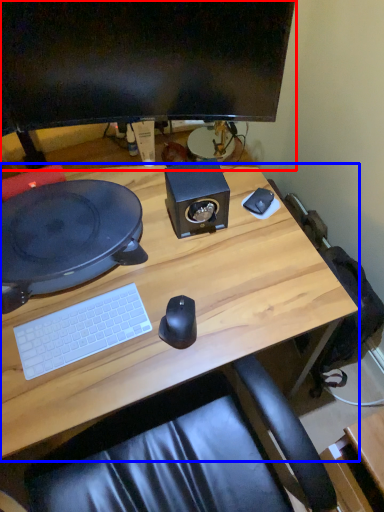
Question: Which object is closer to the camera taking this photo, computer monitor (highlighted by a red box) or desk (highlighted by a blue box)?

Choices:
 (A) computer monitor
 (B) desk

Answer: (B)